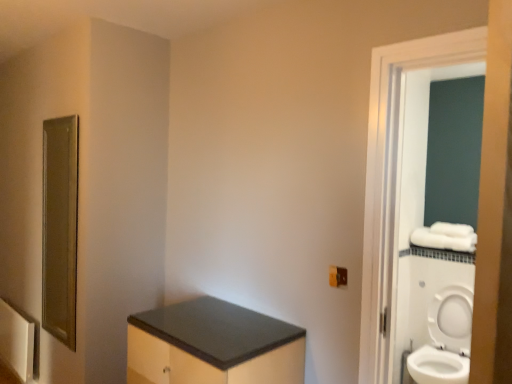
Question: Is matte brown electric outlet at lower right at the right side of matte black cabinet at lower center?

Choices:
 (A) no
 (B) yes

Answer: (B)

Question: From a real-world perspective, does matte brown electric outlet at lower right sit lower than matte black cabinet at lower center?

Choices:
 (A) no
 (B) yes

Answer: (A)

Question: Does matte brown electric outlet at lower right have a lesser height compared to matte black cabinet at lower center?

Choices:
 (A) no
 (B) yes

Answer: (B)

Question: Can matte black cabinet at lower center be found inside matte brown electric outlet at lower right?

Choices:
 (A) yes
 (B) no

Answer: (B)

Question: Does matte brown electric outlet at lower right have a larger size compared to matte black cabinet at lower center?

Choices:
 (A) no
 (B) yes

Answer: (A)

Question: Looking at the image, does matte black cabinet at lower center seem bigger or smaller compared to matte brown electric outlet at lower right?

Choices:
 (A) big
 (B) small

Answer: (A)

Question: From the image's perspective, is matte black cabinet at lower center positioned above or below matte brown electric outlet at lower right?

Choices:
 (A) below
 (B) above

Answer: (A)

Question: Considering the positions of point (227, 367) and point (342, 266), is point (227, 367) closer or farther from the camera than point (342, 266)?

Choices:
 (A) farther
 (B) closer

Answer: (B)

Question: Is matte black cabinet at lower center to the left or to the right of matte brown electric outlet at lower right in the image?

Choices:
 (A) right
 (B) left

Answer: (B)

Question: Looking at their shapes, would you say white glossy toilet at right is wider or thinner than matte black cabinet at lower center?

Choices:
 (A) thin
 (B) wide

Answer: (A)

Question: Is point (433, 355) positioned closer to the camera than point (180, 324)?

Choices:
 (A) farther
 (B) closer

Answer: (A)

Question: From the image's perspective, is white glossy toilet at right above or below matte black cabinet at lower center?

Choices:
 (A) above
 (B) below

Answer: (B)

Question: Based on their sizes in the image, would you say white glossy toilet at right is bigger or smaller than matte black cabinet at lower center?

Choices:
 (A) big
 (B) small

Answer: (B)

Question: Relative to white glossy screen door at right, is white glossy toilet at right in front or behind?

Choices:
 (A) front
 (B) behind

Answer: (B)

Question: In terms of size, does white glossy toilet at right appear bigger or smaller than white glossy screen door at right?

Choices:
 (A) small
 (B) big

Answer: (B)